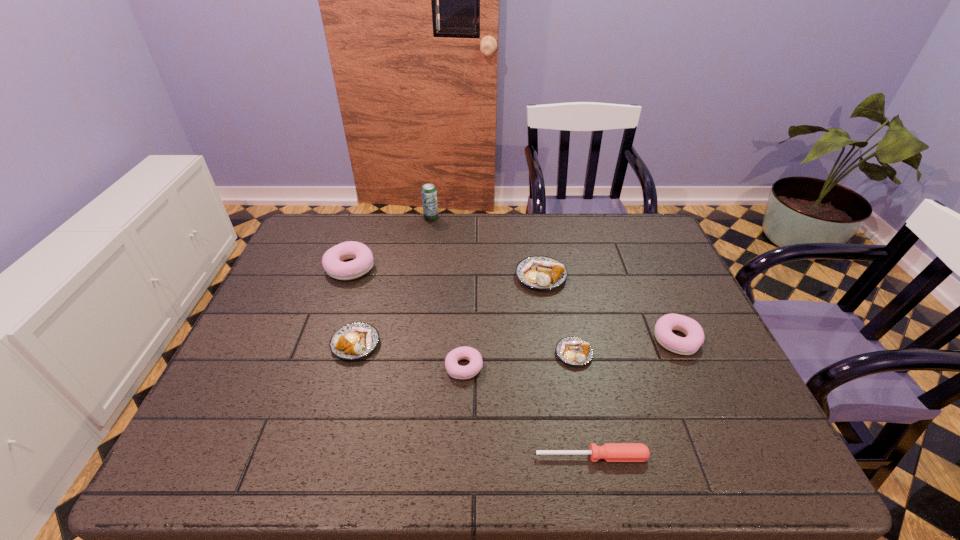
Where is `vacant space that is in between the second smallest brown pastry and the fifth object from right to left`? vacant space that is in between the second smallest brown pastry and the fifth object from right to left is located at coordinates (410, 355).

Image resolution: width=960 pixels, height=540 pixels. I want to click on empty space between the nearest object and the fourth object from left to right, so click(528, 411).

At what (x,y) coordinates should I click in order to perform the action: click on vacant region between the fourth pastry from right to left and the third object from left to right. Please return your answer as a coordinate pair (x, y). The image size is (960, 540). Looking at the image, I should click on click(447, 293).

Locate an element on the screen. The image size is (960, 540). object that stands as the seventh closest to the farthest brown pastry is located at coordinates (611, 452).

Point out which object is positioned as the nearest to the smallest brown pastry. Please provide its 2D coordinates. Your answer should be formatted as a tuple, i.e. [(x, y)], where the tuple contains the x and y coordinates of a point satisfying the conditions above.

[(688, 345)]

I want to click on pastry that stands as the closest to the second pink pastry from right to left, so click(353, 341).

You are a GUI agent. You are given a task and a screenshot of the screen. Output one action in this format:
    pyautogui.click(x=<x>, y=<y>)
    Task: Click on the pastry that stands as the closest to the screwdriver
    
    Given the screenshot: What is the action you would take?
    pyautogui.click(x=456, y=371)

The height and width of the screenshot is (540, 960). Identify the location of the second closest pink pastry relative to the leftmost brown pastry. point(456,371).

The image size is (960, 540). What are the coordinates of `pink pastry that is the closest to the smallest brown pastry` in the screenshot? It's located at (688, 345).

Identify which brown pastry is the nearest to the farthest brown pastry. Please provide its 2D coordinates. Your answer should be formatted as a tuple, i.e. [(x, y)], where the tuple contains the x and y coordinates of a point satisfying the conditions above.

[(574, 351)]